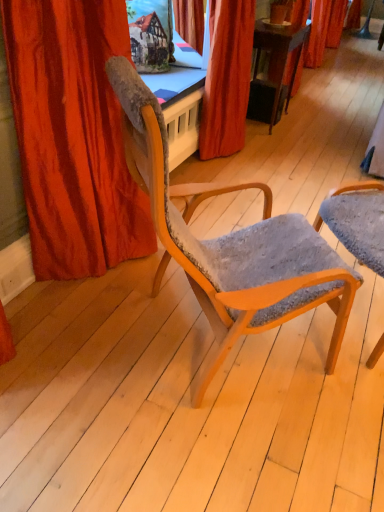
Locate an element on the screen. Image resolution: width=384 pixels, height=512 pixels. vacant area that is in front of wooden chair with textured fabric at center, the 1th chair in the left-to-right sequence is located at coordinates (210, 455).